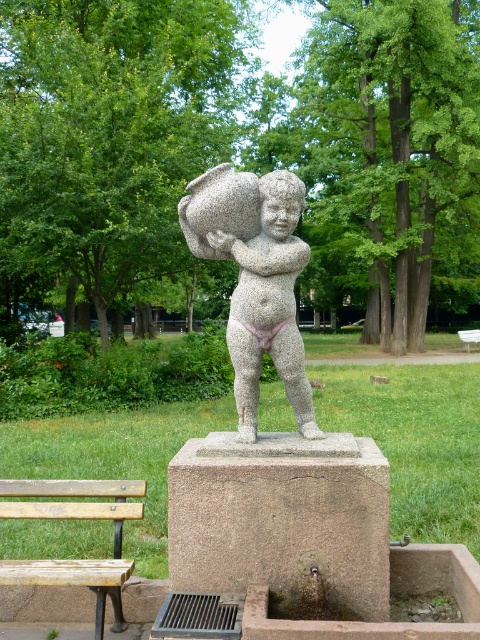
You are planning to place a new flower pot next to the wooden bench at lower left. Considering the size of the granite statue at center, will the flower pot be visible from the front view of the sculpture?

The granite statue at center is larger in size than the wooden bench at lower left. Since the statue is bigger, it might block the view of the flower pot placed next to the bench from the front, depending on their exact positions. However, without specific distance details, it is uncertain. But given the statue is larger, there is a possibility the flower pot could be obscured.